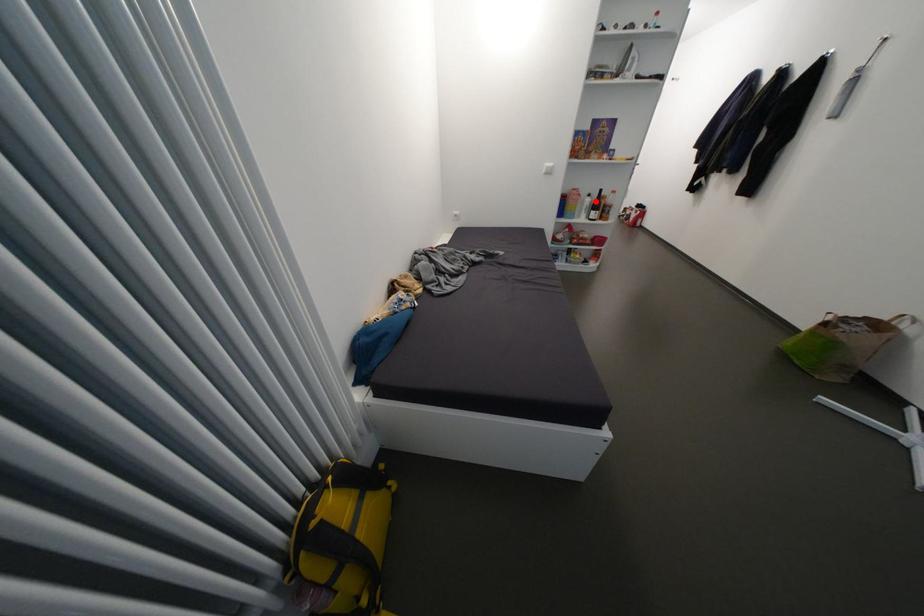
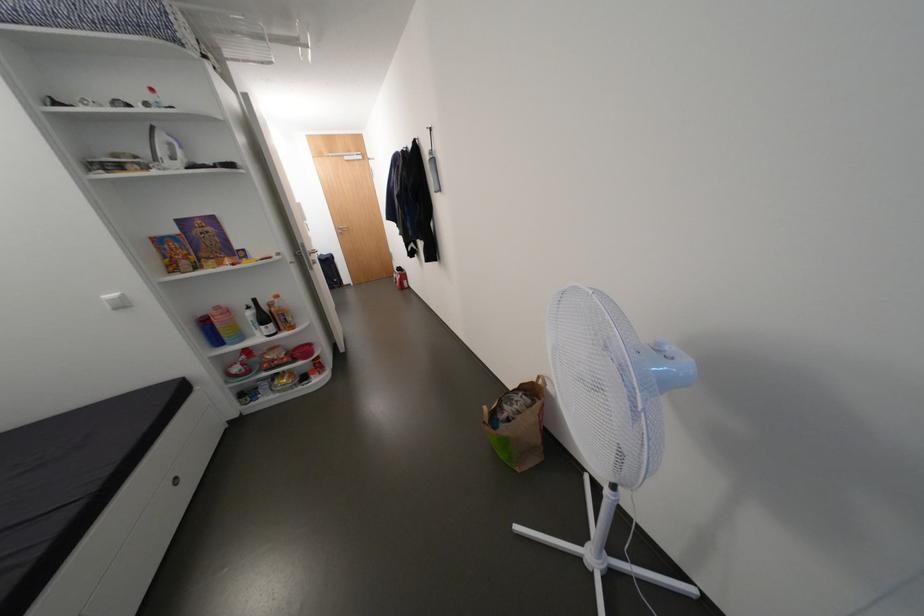
Locate, in the second image, the point that corresponds to the highlighted location in the first image.

(258, 315)